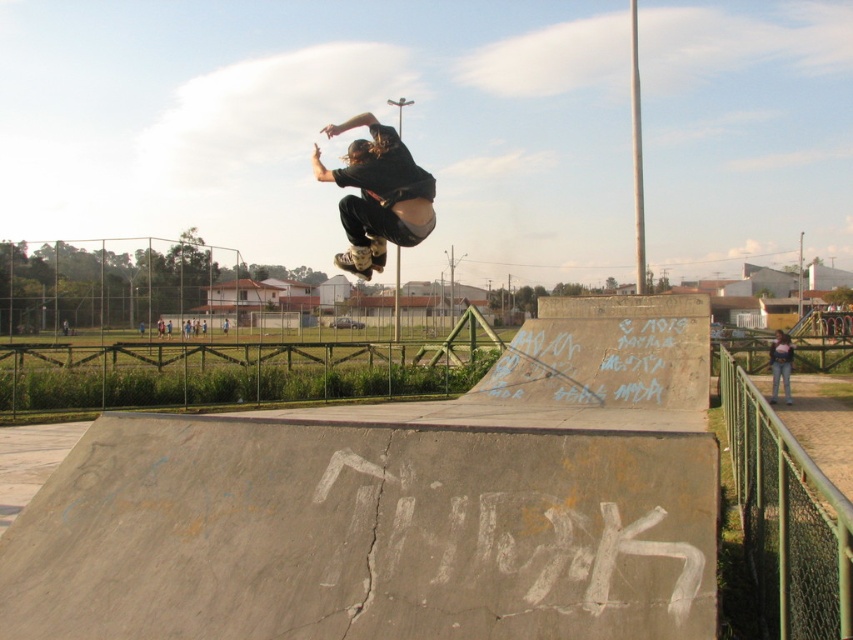
Is point (381, 218) positioned in front of point (335, 260)?

Yes, point (381, 218) is in front of point (335, 260).

Does matte black skateboarder at center have a larger size compared to matte black skateboard at center?

Correct, matte black skateboarder at center is larger in size than matte black skateboard at center.

Measure the distance between matte black skateboarder at center and camera.

matte black skateboarder at center is 7.47 meters away from camera.

The height and width of the screenshot is (640, 853). What are the coordinates of `matte black skateboarder at center` in the screenshot? It's located at [376, 195].

Does matte black skateboarder at center appear on the right side of denim jacket at lower right?

In fact, matte black skateboarder at center is to the left of denim jacket at lower right.

Is matte black skateboarder at center bigger than denim jacket at lower right?

Correct, matte black skateboarder at center is larger in size than denim jacket at lower right.

Is point (416, 220) less distant than point (788, 371)?

Yes, point (416, 220) is closer to viewer.

At what (x,y) coordinates should I click in order to perform the action: click on matte black skateboarder at center. Please return your answer as a coordinate pair (x, y). Image resolution: width=853 pixels, height=640 pixels. Looking at the image, I should click on [x=376, y=195].

Does green chain-link fence at lower right have a greater height compared to matte black skateboarder at center?

No.

Is green chain-link fence at lower right below matte black skateboarder at center?

Indeed, green chain-link fence at lower right is positioned under matte black skateboarder at center.

This screenshot has width=853, height=640. Describe the element at coordinates (786, 518) in the screenshot. I see `green chain-link fence at lower right` at that location.

At what (x,y) coordinates should I click in order to perform the action: click on green chain-link fence at lower right. Please return your answer as a coordinate pair (x, y). Looking at the image, I should click on (786, 518).